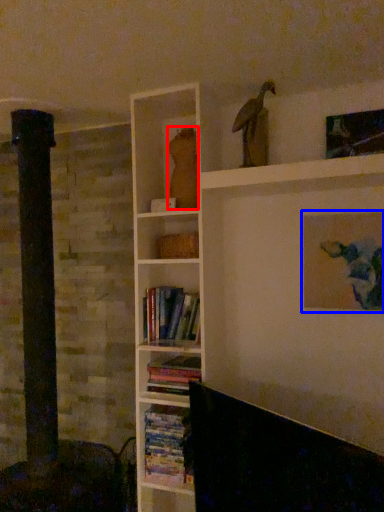
Question: Which point is closer to the camera, animal (highlighted by a red box) or picture frame (highlighted by a blue box)?

Choices:
 (A) animal
 (B) picture frame

Answer: (B)